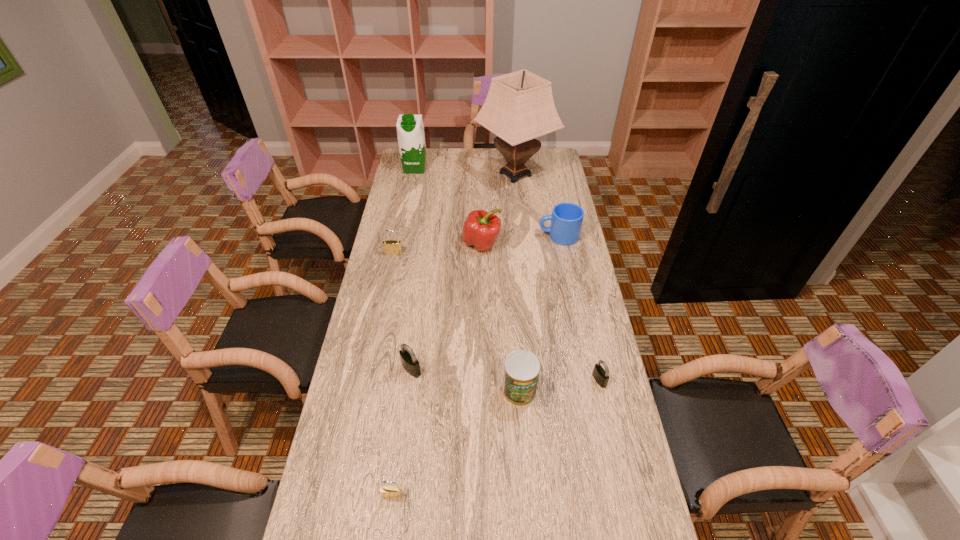
Where is `object at the far left corner`? This screenshot has width=960, height=540. object at the far left corner is located at coordinates (410, 129).

This screenshot has height=540, width=960. I want to click on object at the far right corner, so click(519, 107).

Identify the location of free spot at the far edge of the desktop. The width and height of the screenshot is (960, 540). (x=446, y=164).

Locate an element on the screen. The height and width of the screenshot is (540, 960). free space at the left edge is located at coordinates (374, 387).

Find the location of `free location at the right edge of the desktop`. free location at the right edge of the desktop is located at coordinates 559,182.

Where is `empty space that is in between the left black padlock and the can`? The height and width of the screenshot is (540, 960). empty space that is in between the left black padlock and the can is located at coordinates (466, 380).

Find the location of a particular element. free spot between the green soya milk and the mug is located at coordinates (x=487, y=202).

Where is `unoccupied position between the mug and the rightmost padlock`? The image size is (960, 540). unoccupied position between the mug and the rightmost padlock is located at coordinates (579, 308).

Find the location of a particular element. This screenshot has width=960, height=540. empty location between the pink pepper and the mug is located at coordinates (520, 240).

I want to click on empty location between the nearest padlock and the mug, so click(x=475, y=366).